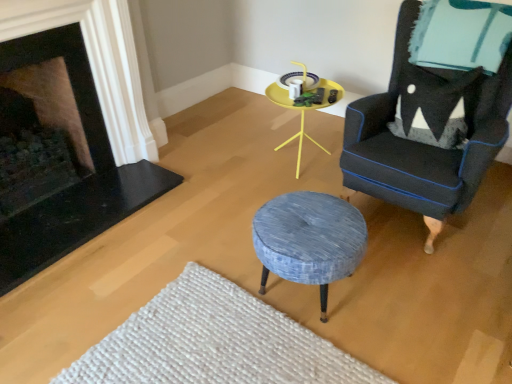
You are a GUI agent. You are given a task and a screenshot of the screen. Output one action in this format:
    pyautogui.click(x=<x>, y=<y>)
    Task: Click on the free space that is in between textured blue fabric stool at center and white textured rug at lower center
    The height and width of the screenshot is (384, 512).
    Given the screenshot: What is the action you would take?
    pyautogui.click(x=343, y=326)